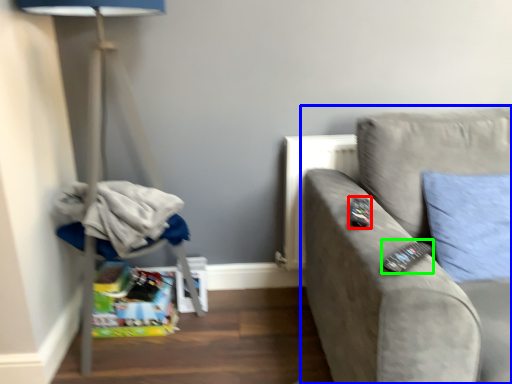
Question: Which object is the farthest from remote (highlighted by a red box)? Choose among these: studio couch (highlighted by a blue box) or remote (highlighted by a green box).

Choices:
 (A) studio couch
 (B) remote

Answer: (A)